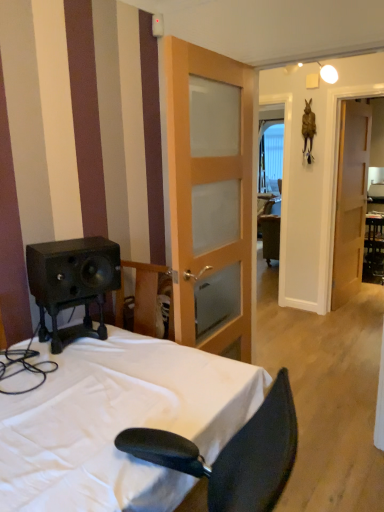
Where is `clear glass window at center`? Image resolution: width=384 pixels, height=512 pixels. clear glass window at center is located at coordinates (270, 156).

The height and width of the screenshot is (512, 384). In order to click on black glossy table at right in this screenshot , I will do `click(374, 248)`.

Locate an element on the screen. light brown wooden door at center, which is the second door from back to front is located at coordinates (211, 195).

What's the angular difference between white fabric bed at lower left and wooden door at right, the second door in the front-to-back sequence,'s facing directions?

157 degrees separate the facing orientations of white fabric bed at lower left and wooden door at right, the second door in the front-to-back sequence.

Looking at their sizes, would you say white fabric bed at lower left is wider or thinner than wooden door at right, which is the first door from back to front?

Considering their sizes, white fabric bed at lower left looks broader than wooden door at right, which is the first door from back to front.

Is white fabric bed at lower left taller than wooden door at right, placed as the 2th door when sorted from left to right?

No, white fabric bed at lower left is not taller than wooden door at right, placed as the 2th door when sorted from left to right.

From the image's perspective, is white fabric bed at lower left on top of wooden door at right, the second door in the front-to-back sequence?

No, from the image's perspective, white fabric bed at lower left is not on top of wooden door at right, the second door in the front-to-back sequence.

From the image's perspective, between clear glass window at center and light brown wooden door at center, which is the first door from front to back, who is located below?

light brown wooden door at center, which is the first door from front to back.

Is point (265, 174) more distant than point (168, 148)?

Yes, point (265, 174) is behind point (168, 148).

Is clear glass window at center at the right side of light brown wooden door at center, positioned as the second door in right-to-left order?

Yes, clear glass window at center is to the right of light brown wooden door at center, positioned as the second door in right-to-left order.

Where is `the 2nd door in front of the clear glass window at center, counting from the anchor's position`? This screenshot has width=384, height=512. the 2nd door in front of the clear glass window at center, counting from the anchor's position is located at coordinates (211, 195).

Between clear glass window at center and wooden door at right, the 1th door in the right-to-left sequence, which one is positioned behind?

clear glass window at center is further from the camera.

From the image's perspective, which one is positioned higher, clear glass window at center or wooden door at right, placed as the 2th door when sorted from left to right?

From the image's view, clear glass window at center is above.

Is clear glass window at center outside of wooden door at right, the second door in the front-to-back sequence?

Yes.

Find the location of `window behind the black glossy table at right`. window behind the black glossy table at right is located at coordinates (270, 156).

Is black glossy table at right not inside clear glass window at center?

Indeed, black glossy table at right is completely outside clear glass window at center.

Is black glossy table at right wider than clear glass window at center?

Correct, the width of black glossy table at right exceeds that of clear glass window at center.

This screenshot has height=512, width=384. In order to click on bed in front of the light brown wooden door at center, which is the second door from back to front in this screenshot , I will do `click(118, 422)`.

From the image's perspective, is white fabric bed at lower left positioned above or below light brown wooden door at center, which is the first door from front to back?

Clearly, from the image's perspective, white fabric bed at lower left is below light brown wooden door at center, which is the first door from front to back.

Is white fabric bed at lower left looking in the opposite direction of light brown wooden door at center, positioned as the second door in right-to-left order?

No.

From a real-world perspective, which object rests below the other?

white fabric bed at lower left is physically lower.

Is white fabric bed at lower left at the back of black glossy table at right?

No, black glossy table at right is not facing away from white fabric bed at lower left.

Is black glossy table at right taller than white fabric bed at lower left?

Yes, black glossy table at right is taller than white fabric bed at lower left.

From the image's perspective, is black glossy table at right above or below white fabric bed at lower left?

Based on their image positions, black glossy table at right is located above white fabric bed at lower left.

Are black glossy table at right and white fabric bed at lower left far apart?

black glossy table at right is far away from white fabric bed at lower left.

How much distance is there between light brown wooden door at center, which is the second door from back to front, and wooden door at right, which is the first door from back to front?

light brown wooden door at center, which is the second door from back to front, is 7.56 feet from wooden door at right, which is the first door from back to front.

Which is more to the right, light brown wooden door at center, which is the first door from front to back, or wooden door at right, which is the first door from back to front?

From the viewer's perspective, wooden door at right, which is the first door from back to front, appears more on the right side.

Does light brown wooden door at center, the first door from the left, come behind wooden door at right, the second door in the front-to-back sequence?

No, light brown wooden door at center, the first door from the left, is closer to the viewer.

Consider the image. From the image's perspective, is light brown wooden door at center, the first door from the left, above wooden door at right, the second door in the front-to-back sequence?

No, from the image's perspective, light brown wooden door at center, the first door from the left, is not above wooden door at right, the second door in the front-to-back sequence.

Where is `the 1st door located above the white fabric bed at lower left (from a real-world perspective)`? The width and height of the screenshot is (384, 512). the 1st door located above the white fabric bed at lower left (from a real-world perspective) is located at coordinates pos(351,200).

Find the location of a particular element. window on the right side of light brown wooden door at center, positioned as the second door in right-to-left order is located at coordinates pyautogui.click(x=270, y=156).

When comparing their distances from white fabric bed at lower left, does light brown wooden door at center, positioned as the second door in right-to-left order, or clear glass window at center seem closer?

Among the two, light brown wooden door at center, positioned as the second door in right-to-left order, is located nearer to white fabric bed at lower left.

Looking at the image, which one is located closer to black glossy table at right, wooden door at right, which is the first door from back to front, or white fabric bed at lower left?

wooden door at right, which is the first door from back to front.

Estimate the real-world distances between objects in this image. Which object is further from black glossy table at right, light brown wooden door at center, positioned as the second door in right-to-left order, or white fabric bed at lower left?

white fabric bed at lower left is positioned further to the anchor black glossy table at right.

Which object lies nearer to the anchor point clear glass window at center, black glossy table at right or light brown wooden door at center, positioned as the second door in right-to-left order?

black glossy table at right is positioned closer to the anchor clear glass window at center.

From the picture: Looking at the image, which one is located closer to white fabric bed at lower left, wooden door at right, placed as the 2th door when sorted from left to right, or black glossy table at right?

wooden door at right, placed as the 2th door when sorted from left to right, lies closer to white fabric bed at lower left than the other object.

From the image, which object appears to be nearer to white fabric bed at lower left, clear glass window at center or wooden door at right, the 1th door in the right-to-left sequence?

Based on the image, wooden door at right, the 1th door in the right-to-left sequence, appears to be nearer to white fabric bed at lower left.

Considering their positions, is wooden door at right, which is the first door from back to front, positioned closer to light brown wooden door at center, which is the second door from back to front, than white fabric bed at lower left?

Answer: The object closer to light brown wooden door at center, which is the second door from back to front, is white fabric bed at lower left.

Looking at the image, which one is located closer to black glossy table at right, white fabric bed at lower left or light brown wooden door at center, positioned as the second door in right-to-left order?

light brown wooden door at center, positioned as the second door in right-to-left order, is positioned closer to the anchor black glossy table at right.

This screenshot has width=384, height=512. Identify the location of table between white fabric bed at lower left and clear glass window at center from front to back. (374, 248).

The height and width of the screenshot is (512, 384). What are the coordinates of `door between light brown wooden door at center, which is the second door from back to front, and black glossy table at right in the front-back direction` in the screenshot? It's located at (351, 200).

Image resolution: width=384 pixels, height=512 pixels. Find the location of `table between light brown wooden door at center, positioned as the second door in right-to-left order, and clear glass window at center from front to back`. table between light brown wooden door at center, positioned as the second door in right-to-left order, and clear glass window at center from front to back is located at coordinates (374, 248).

Locate an element on the screen. table between wooden door at right, the 1th door in the right-to-left sequence, and clear glass window at center in the front-back direction is located at coordinates (374, 248).